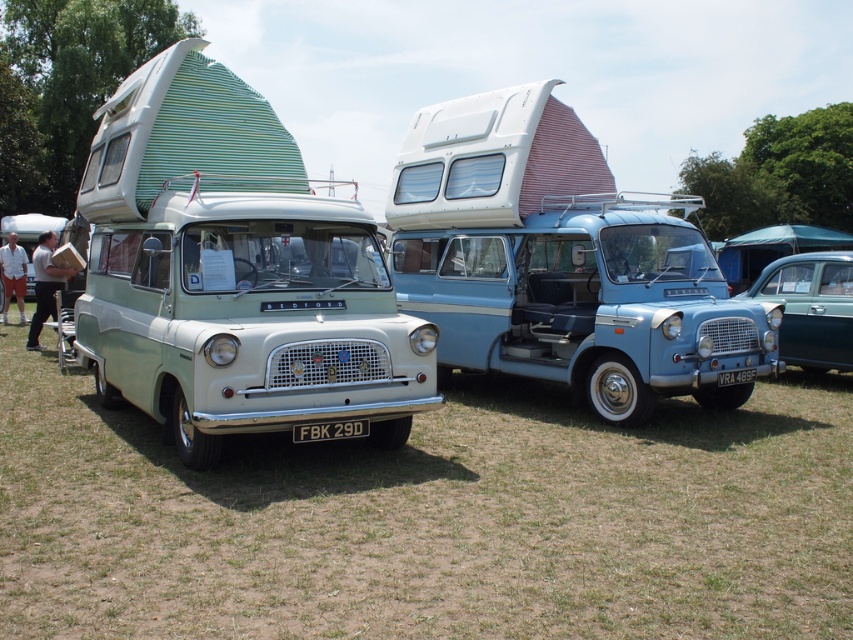
You are planning to tow a trailer that requires a minimum clearance of 2 meters. Both the light blue metallic van at center and the matte green van at center are parked in a narrow alley. Which van should you choose to ensure the trailer can pass through without hitting the sides?

The light blue metallic van at center is thinner than the matte green van at center, so you should choose the light blue metallic van at center to ensure the trailer can pass through the narrow alley without hitting the sides.

You are standing in front of the two vans and want to walk to the matte green van at center. Which direction should you move relative to the light blue metallic van at center?

The matte green van at center is behind the light blue metallic van at center, so you should move behind the light blue metallic van at center to reach the matte green van at center.